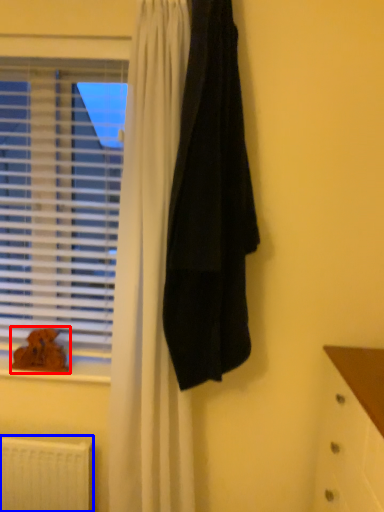
Question: Which of the following is the farthest to the observer, animal (highlighted by a red box) or radiator (highlighted by a blue box)?

Choices:
 (A) animal
 (B) radiator

Answer: (A)